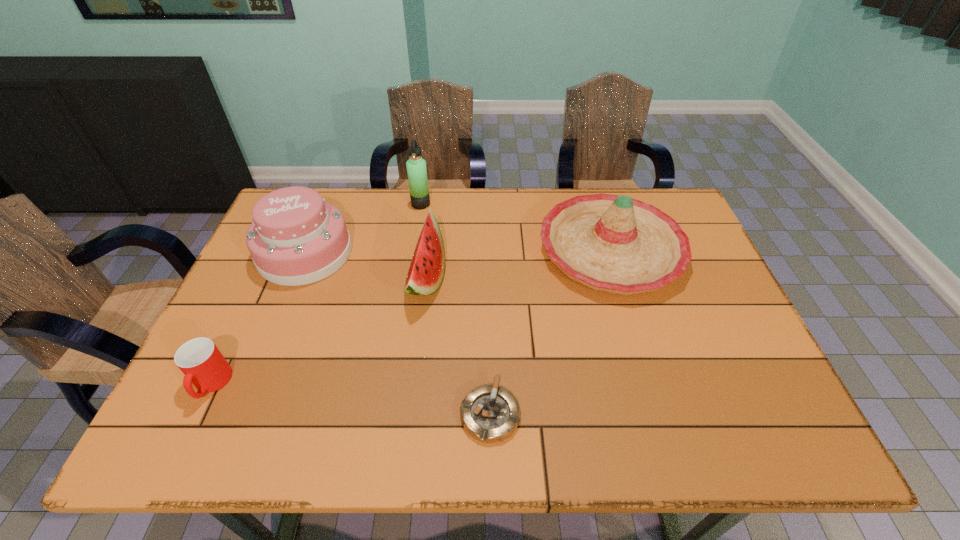
Locate an element on the screen. The height and width of the screenshot is (540, 960). thermos bottle is located at coordinates (416, 166).

Where is `sombrero`? sombrero is located at coordinates (616, 244).

What are the coordinates of `cake` in the screenshot? It's located at (296, 238).

Find the location of a particular element. This screenshot has height=540, width=960. the fourth tallest object is located at coordinates (426, 271).

Find the location of `the second shortest object`. the second shortest object is located at coordinates (203, 365).

You are a GUI agent. You are given a task and a screenshot of the screen. Output one action in this format:
    pyautogui.click(x=<x>, y=<y>)
    Task: Click on the shortest object
    The width and height of the screenshot is (960, 540).
    Given the screenshot: What is the action you would take?
    pyautogui.click(x=490, y=413)

The image size is (960, 540). I want to click on ashtray, so click(x=490, y=413).

Where is `vacant area situated 0.330m on the front of the thermos bottle`? vacant area situated 0.330m on the front of the thermos bottle is located at coordinates (409, 283).

At what (x,y) coordinates should I click in order to perform the action: click on free space located on the front of the rightmost object. Please return your answer as a coordinate pair (x, y). Looking at the image, I should click on (655, 394).

Image resolution: width=960 pixels, height=540 pixels. What are the coordinates of `free location located on the right of the cake` in the screenshot? It's located at (460, 253).